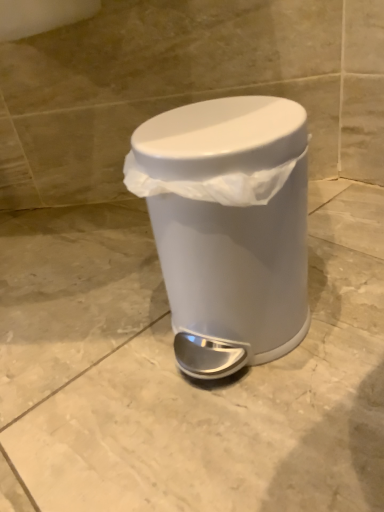
Where is `blank space to the left of white plastic waste container at center`? blank space to the left of white plastic waste container at center is located at coordinates (84, 353).